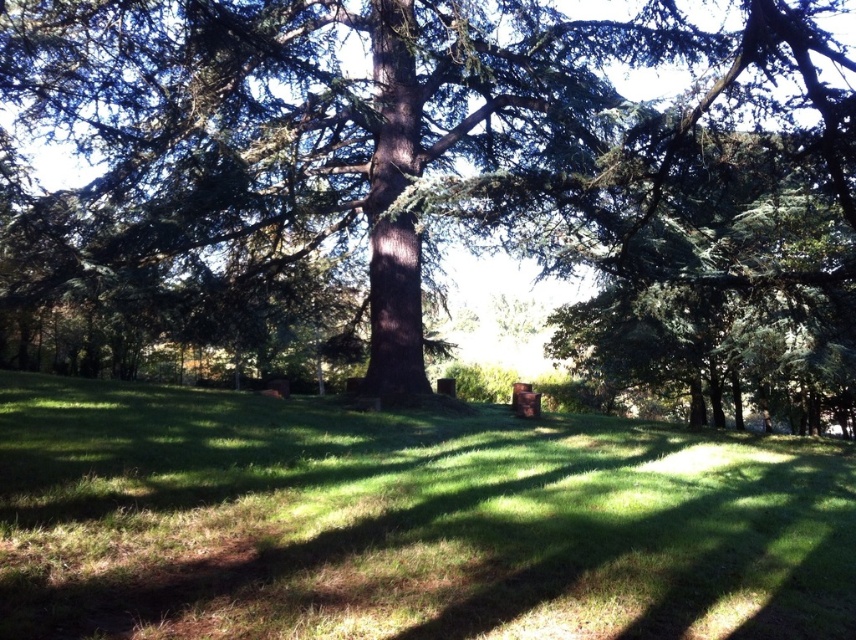
Question: Considering the relative positions of green textured tree at center and green grassy at center in the image provided, where is green textured tree at center located with respect to green grassy at center?

Choices:
 (A) left
 (B) right

Answer: (A)

Question: From the image, what is the correct spatial relationship of green textured tree at center in relation to green grassy at center?

Choices:
 (A) left
 (B) right

Answer: (A)

Question: Does green textured tree at center appear under green grassy at center?

Choices:
 (A) no
 (B) yes

Answer: (A)

Question: Among these points, which one is nearest to the camera?

Choices:
 (A) (324, 468)
 (B) (771, 122)

Answer: (B)